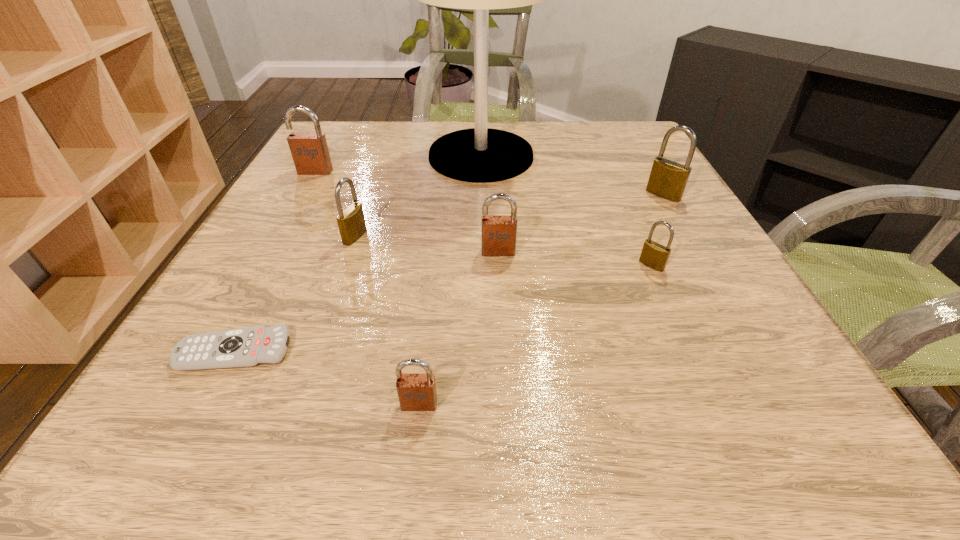
I want to click on vacant space at the right edge of the desktop, so click(644, 181).

Where is `vacant space at the far left corner of the desktop`? This screenshot has width=960, height=540. vacant space at the far left corner of the desktop is located at coordinates (368, 147).

Locate an element on the screen. This screenshot has height=540, width=960. free space between the biggest brown padlock and the beige table lamp is located at coordinates (398, 164).

You are a GUI agent. You are given a task and a screenshot of the screen. Output one action in this format:
    pyautogui.click(x=<x>, y=<y>)
    Task: Click on the free area in between the third object from left to right and the fifth farthest object
    
    Given the screenshot: What is the action you would take?
    pyautogui.click(x=426, y=244)

Where is `free space between the nearest padlock and the second nearest object`? free space between the nearest padlock and the second nearest object is located at coordinates (326, 377).

At what (x,y) coordinates should I click in order to perform the action: click on vacant space that's between the second nearest object and the biggest brass padlock. Please return your answer as a coordinate pair (x, y). Looking at the image, I should click on (449, 273).

Locate an element on the screen. This screenshot has height=540, width=960. free space between the biggest brown padlock and the biggest brass padlock is located at coordinates (490, 183).

Find the location of a particular element. This screenshot has width=960, height=540. vacant area that lies between the farthest brown padlock and the remote control is located at coordinates (275, 261).

This screenshot has height=540, width=960. What are the coordinates of `free space between the fourth padlock from left to right and the beige table lamp` in the screenshot? It's located at (490, 204).

In order to click on unoccupied position between the second padlock from right to left and the shortest object in this screenshot , I will do `click(443, 308)`.